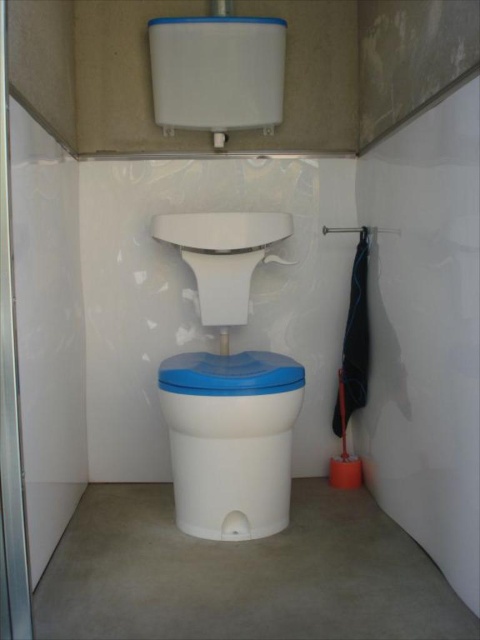
You are a contractor measuring the restroom for renovations. You need to install a new toilet that must be taller than the existing one. Can you place it where the white plastic toilet bowl at center currently is, considering the height of the transparent glass screen door at left?

The white plastic toilet bowl at center is shorter than the transparent glass screen door at left. Since the new toilet needs to be taller than the existing one, you must ensure that its increased height does not exceed the height of the transparent glass screen door at left. Measure the available space between the toilet location and the ceiling or any overhead fixtures to confirm if the taller toilet will fit without obstruction.

You are standing in the restroom and want to move from point (280,516) to point (21,531). Which direction should you move to get closer to your destination?

You should move downward because point (280,516) is further to the viewer than point (21,531), so moving downward will bring you closer to the destination.

You are standing in the restroom and want to exit through the door. The transparent glass screen door at left is the only exit. Can you walk directly to it without moving around the white plastic toilet bowl at center?

The white plastic toilet bowl at center is further to the viewer than the transparent glass screen door at left, so you would need to move around the toilet to reach the door.